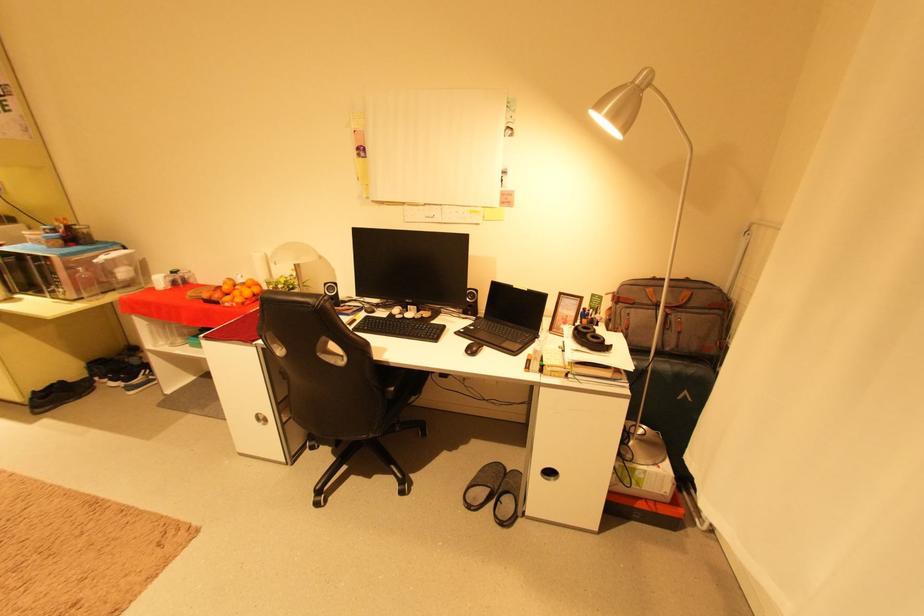
You are a GUI agent. You are given a task and a screenshot of the screen. Output one action in this format:
    pyautogui.click(x=<x>, y=<y>)
    Task: Click on the black chair sitting surface
    
    Given the screenshot: What is the action you would take?
    pyautogui.click(x=400, y=382)